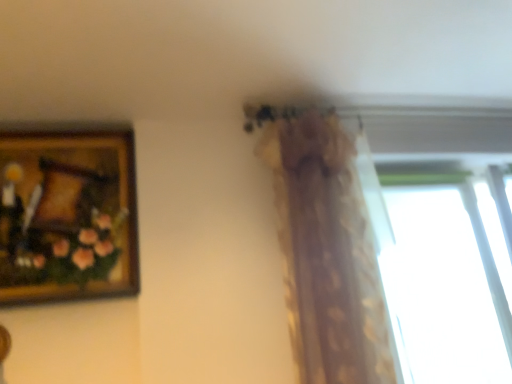
What do you see at coordinates (325, 248) in the screenshot? I see `translucent floral-patterned curtain at upper center` at bounding box center [325, 248].

The height and width of the screenshot is (384, 512). What do you see at coordinates (67, 213) in the screenshot? I see `wooden framed painting at upper left` at bounding box center [67, 213].

The image size is (512, 384). Identify the location of translucent floral-patterned curtain at upper center. (325, 248).

Between point (80, 223) and point (323, 240), which one is positioned in front?

The point (80, 223) is more forward.

Would you say wooden framed painting at upper left is to the left or to the right of translucent floral-patterned curtain at upper center in the picture?

In the image, wooden framed painting at upper left appears on the left side of translucent floral-patterned curtain at upper center.

Between wooden framed painting at upper left and translucent floral-patterned curtain at upper center, which one has more height?

Standing taller between the two is translucent floral-patterned curtain at upper center.

From the image's perspective, relative to translucent floral-patterned curtain at upper center, is wooden framed painting at upper left above or below?

From the image's perspective, wooden framed painting at upper left appears above translucent floral-patterned curtain at upper center.

Would you say transparent glass window at upper right is part of translucent floral-patterned curtain at upper center's contents?

No, transparent glass window at upper right is located outside of translucent floral-patterned curtain at upper center.

From a real-world perspective, does translucent floral-patterned curtain at upper center stand above transparent glass window at upper right?

Yes, from a real-world perspective, translucent floral-patterned curtain at upper center is above transparent glass window at upper right.

Is translucent floral-patterned curtain at upper center thinner than transparent glass window at upper right?

In fact, translucent floral-patterned curtain at upper center might be wider than transparent glass window at upper right.

Based on the photo, how much distance is there between translucent floral-patterned curtain at upper center and transparent glass window at upper right?

A distance of 1.23 meters exists between translucent floral-patterned curtain at upper center and transparent glass window at upper right.

Is the position of transparent glass window at upper right less distant than that of translucent floral-patterned curtain at upper center?

No, it is not.

Is transparent glass window at upper right oriented towards translucent floral-patterned curtain at upper center?

No, transparent glass window at upper right is not aimed at translucent floral-patterned curtain at upper center.

From the image's perspective, which one is positioned lower, transparent glass window at upper right or translucent floral-patterned curtain at upper center?

From the image's view, transparent glass window at upper right is below.

Are transparent glass window at upper right and translucent floral-patterned curtain at upper center beside each other?

No, transparent glass window at upper right is not touching translucent floral-patterned curtain at upper center.

In terms of size, does translucent floral-patterned curtain at upper center appear bigger or smaller than wooden framed painting at upper left?

Considering their sizes, translucent floral-patterned curtain at upper center takes up more space than wooden framed painting at upper left.

In the scene shown: From a real-world perspective, between translucent floral-patterned curtain at upper center and wooden framed painting at upper left, who is vertically lower?

translucent floral-patterned curtain at upper center, from a real-world perspective.

Looking at this image, are translucent floral-patterned curtain at upper center and wooden framed painting at upper left located far from each other?

translucent floral-patterned curtain at upper center is actually quite close to wooden framed painting at upper left.

Considering the sizes of objects wooden framed painting at upper left and transparent glass window at upper right in the image provided, who is smaller, wooden framed painting at upper left or transparent glass window at upper right?

transparent glass window at upper right is smaller.

From a real-world perspective, is wooden framed painting at upper left over transparent glass window at upper right?

Yes, from a real-world perspective, wooden framed painting at upper left is on top of transparent glass window at upper right.

From the picture: Measure the distance from wooden framed painting at upper left to transparent glass window at upper right.

1.78 meters.

Is wooden framed painting at upper left positioned far away from transparent glass window at upper right?

Indeed, wooden framed painting at upper left is not near transparent glass window at upper right.

Is transparent glass window at upper right taller or shorter than wooden framed painting at upper left?

transparent glass window at upper right is taller than wooden framed painting at upper left.

Is point (381, 216) closer or farther from the camera than point (71, 130)?

Point (381, 216) is positioned farther from the camera compared to point (71, 130).

Does transparent glass window at upper right have a smaller size compared to wooden framed painting at upper left?

Indeed, transparent glass window at upper right has a smaller size compared to wooden framed painting at upper left.

Where is `picture frame positioned vertically above the transparent glass window at upper right (from a real-world perspective)`? Image resolution: width=512 pixels, height=384 pixels. picture frame positioned vertically above the transparent glass window at upper right (from a real-world perspective) is located at coordinates (67, 213).

Identify the location of picture frame behind the translucent floral-patterned curtain at upper center. (67, 213).

The width and height of the screenshot is (512, 384). I want to click on curtain lying on the left of transparent glass window at upper right, so click(x=325, y=248).

Looking at the image, which one is located closer to translucent floral-patterned curtain at upper center, wooden framed painting at upper left or transparent glass window at upper right?

Based on the image, wooden framed painting at upper left appears to be nearer to translucent floral-patterned curtain at upper center.

From the image, which object appears to be farther from transparent glass window at upper right, wooden framed painting at upper left or translucent floral-patterned curtain at upper center?

Based on the image, wooden framed painting at upper left appears to be further to transparent glass window at upper right.

From the image, which object appears to be farther from wooden framed painting at upper left, translucent floral-patterned curtain at upper center or transparent glass window at upper right?

transparent glass window at upper right is further to wooden framed painting at upper left.

When comparing their distances from translucent floral-patterned curtain at upper center, does transparent glass window at upper right or wooden framed painting at upper left seem further?

transparent glass window at upper right lies further to translucent floral-patterned curtain at upper center than the other object.

Which object lies nearer to the anchor point wooden framed painting at upper left, transparent glass window at upper right or translucent floral-patterned curtain at upper center?

translucent floral-patterned curtain at upper center is closer to wooden framed painting at upper left.

When comparing their distances from transparent glass window at upper right, does translucent floral-patterned curtain at upper center or wooden framed painting at upper left seem further?

wooden framed painting at upper left.

The height and width of the screenshot is (384, 512). I want to click on curtain between wooden framed painting at upper left and transparent glass window at upper right in the horizontal direction, so click(325, 248).